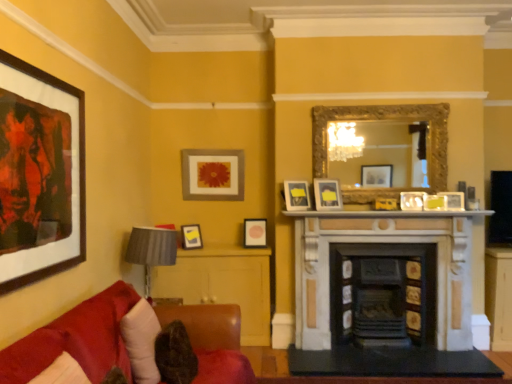
Locate an element on the screen. The height and width of the screenshot is (384, 512). free space above matte black picture frame at left, positioned as the eighth picture frame in back-to-front order (from a real-world perspective) is located at coordinates 41,59.